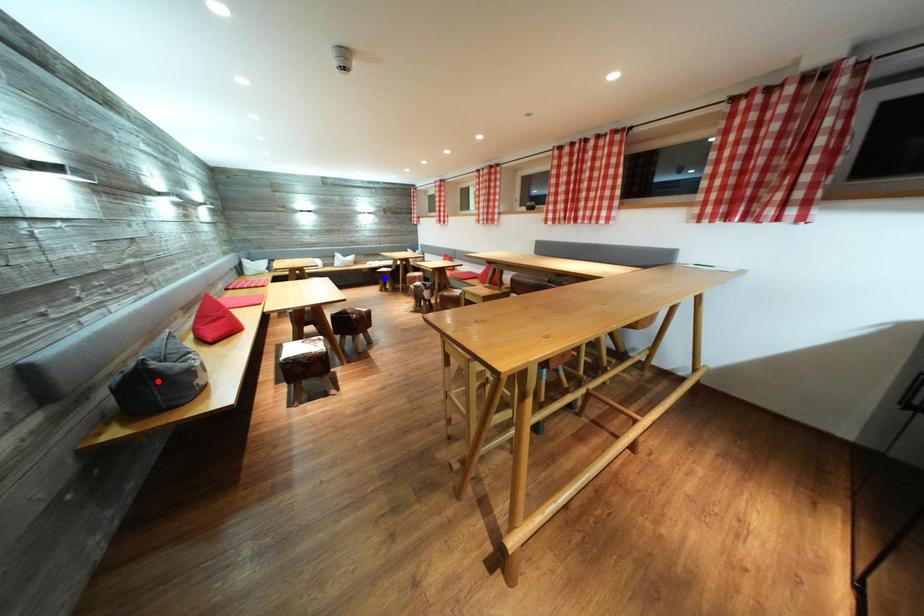
Question: In the image, two points are highlighted. Which point is nearer to the camera? Reply with the corresponding letter.

Choices:
 (A) blue point
 (B) red point

Answer: (B)